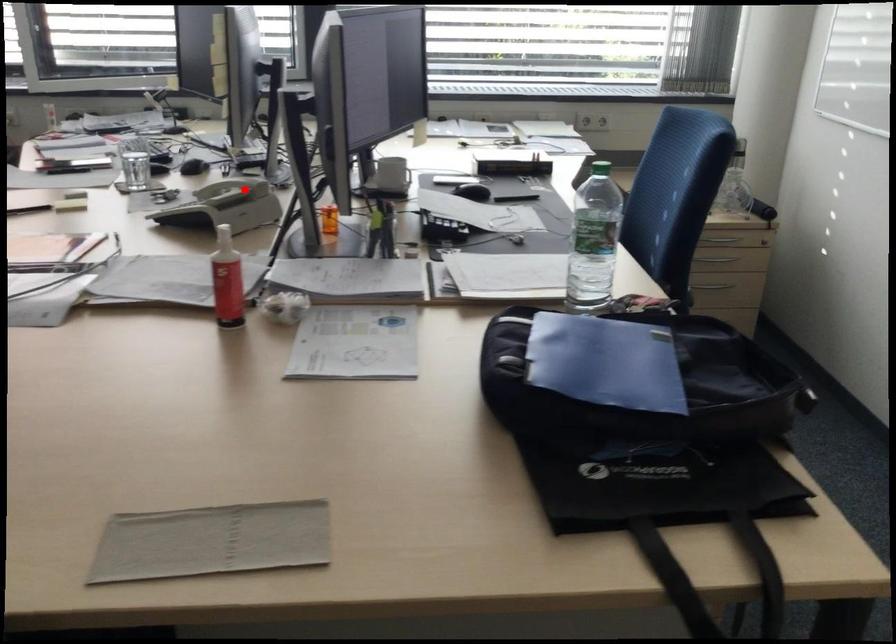
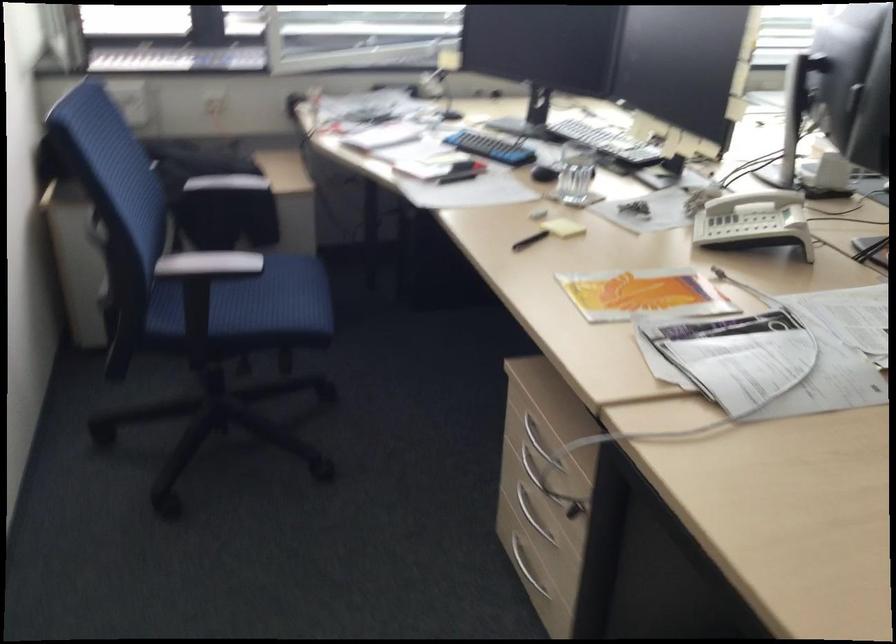
Find the pixel in the second image that matches the highlighted location in the first image.

(753, 200)